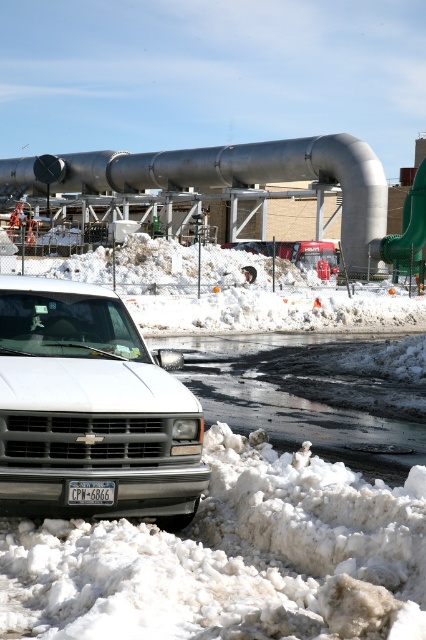
Does white fluffy snow at lower center have a greater height compared to brushed metal pipe at center?

In fact, white fluffy snow at lower center may be shorter than brushed metal pipe at center.

Who is more forward, (63, 552) or (37, 182)?

Point (63, 552) is more forward.

The width and height of the screenshot is (426, 640). Find the location of `white fluffy snow at lower center`. white fluffy snow at lower center is located at coordinates (233, 557).

Measure the distance between point [281,156] and camera.

Point [281,156] and camera are 165.96 feet apart.

Does brushed metal pipe at center appear on the left side of matte black license plate at center?

Correct, you'll find brushed metal pipe at center to the left of matte black license plate at center.

Describe the element at coordinates (227, 177) in the screenshot. I see `brushed metal pipe at center` at that location.

Find the location of a particular element. This screenshot has width=426, height=640. brushed metal pipe at center is located at coordinates (227, 177).

Is white fluffy snow at lower center bigger than white matte truck at lower left?

Yes, white fluffy snow at lower center is bigger than white matte truck at lower left.

Which is in front, point (250, 572) or point (189, 481)?

Positioned in front is point (250, 572).

Find the location of a particular element. This screenshot has width=426, height=640. white fluffy snow at lower center is located at coordinates (233, 557).